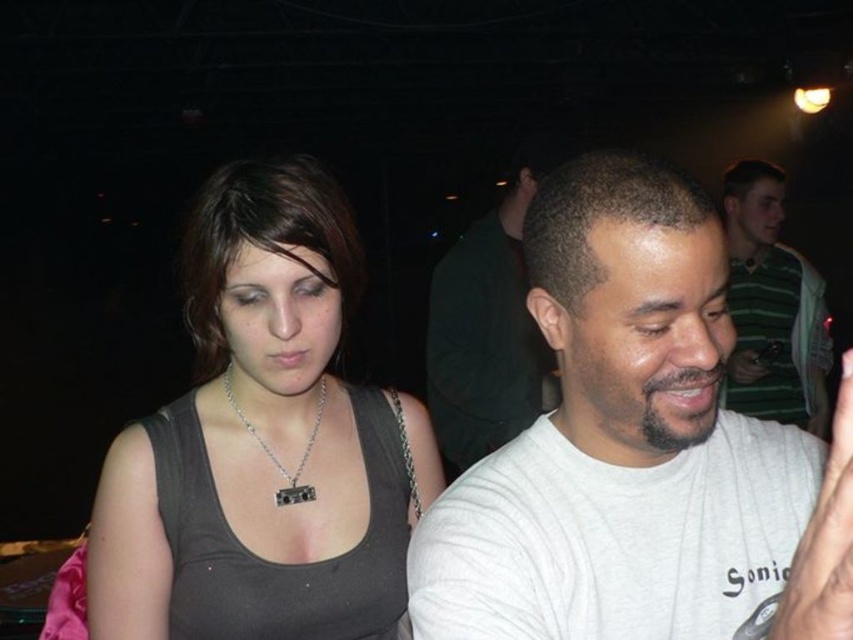
Is white cotton t-shirt at center above green striped shirt at upper right?

No, white cotton t-shirt at center is not above green striped shirt at upper right.

Who is taller, white cotton t-shirt at center or green striped shirt at upper right?

green striped shirt at upper right

Is point (637, 160) in front of point (784, 324)?

Yes, point (637, 160) is closer to viewer.

Identify the location of white cotton t-shirt at center. The image size is (853, 640). (637, 451).

Consider the image. Which is more to the right, green striped shirt at upper right or white matte hand at lower right?

Positioned to the right is green striped shirt at upper right.

At what (x,y) coordinates should I click in order to perform the action: click on green striped shirt at upper right. Please return your answer as a coordinate pair (x, y). Image resolution: width=853 pixels, height=640 pixels. Looking at the image, I should click on (772, 307).

Describe the element at coordinates (772, 307) in the screenshot. Image resolution: width=853 pixels, height=640 pixels. I see `green striped shirt at upper right` at that location.

The image size is (853, 640). Identify the location of green striped shirt at upper right. (772, 307).

Between matte black tank top at center and green striped shirt at upper right, which one has more height?

Standing taller between the two is green striped shirt at upper right.

Is matte black tank top at center behind green striped shirt at upper right?

That is False.

Which is behind, point (152, 512) or point (730, 212)?

Positioned behind is point (730, 212).

Where is `matte black tank top at center`? This screenshot has height=640, width=853. matte black tank top at center is located at coordinates (258, 442).